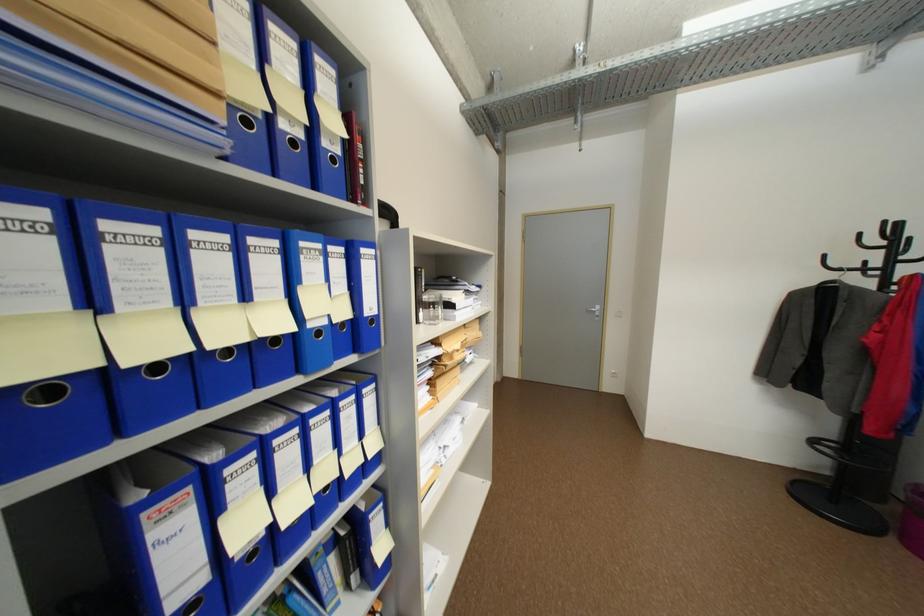
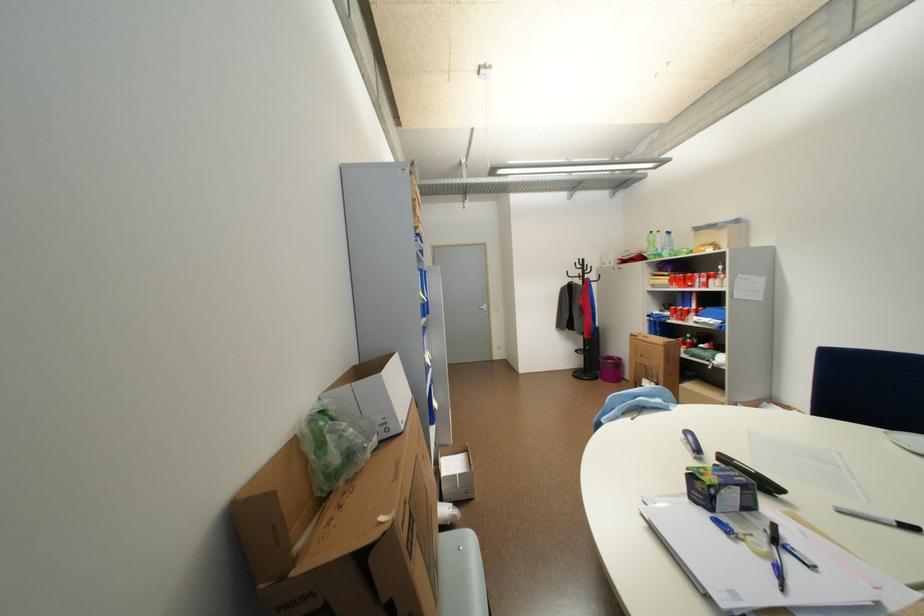
In a continuous first-person perspective shot, in which direction is the camera moving?

The cameraman walked toward left, backward.